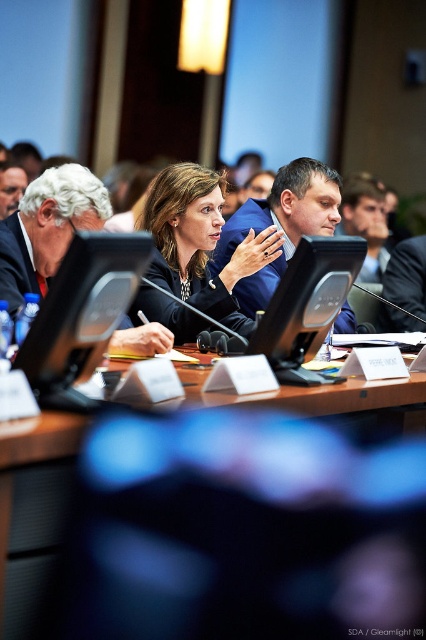
Which is behind, point (40, 524) or point (115, 298)?

The point (115, 298) is behind.

Between point (365, 572) and point (124, 266), which one is positioned behind?

Point (124, 266)

Find the location of `brown wooden table at center`. brown wooden table at center is located at coordinates (221, 518).

Is matte black suit at center thinner than black plastic computer at center?

No.

Can you confirm if matte black suit at center is positioned to the left of black plastic computer at center?

No, matte black suit at center is not to the left of black plastic computer at center.

The image size is (426, 640). What do you see at coordinates (199, 243) in the screenshot? I see `matte black suit at center` at bounding box center [199, 243].

Find the location of a particular element. Image resolution: width=426 pixels, height=640 pixels. matte black suit at center is located at coordinates [x=199, y=243].

Between point (206, 228) and point (45, 278), which one is positioned in front?

Point (45, 278) is in front.

Consider the image. Is matte black suit at center further to camera compared to white matte suit at center?

That is True.

This screenshot has width=426, height=640. Describe the element at coordinates (199, 243) in the screenshot. I see `matte black suit at center` at that location.

Find the location of a particular element. matte black suit at center is located at coordinates (199, 243).